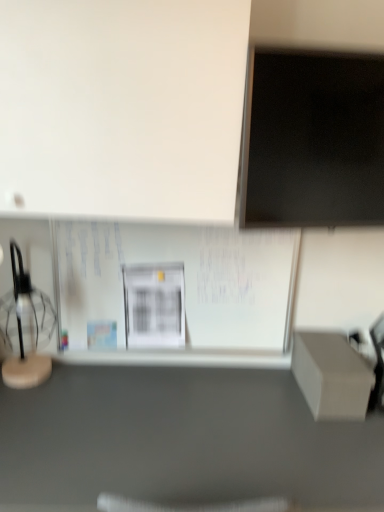
In order to click on vacant space in front of translucent glass table lamp at left in this screenshot , I will do `click(28, 411)`.